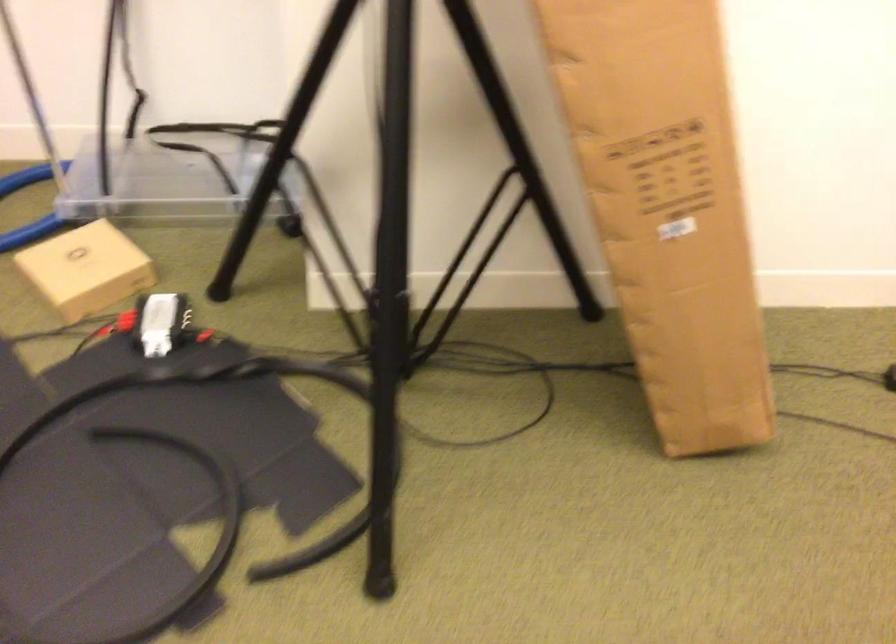
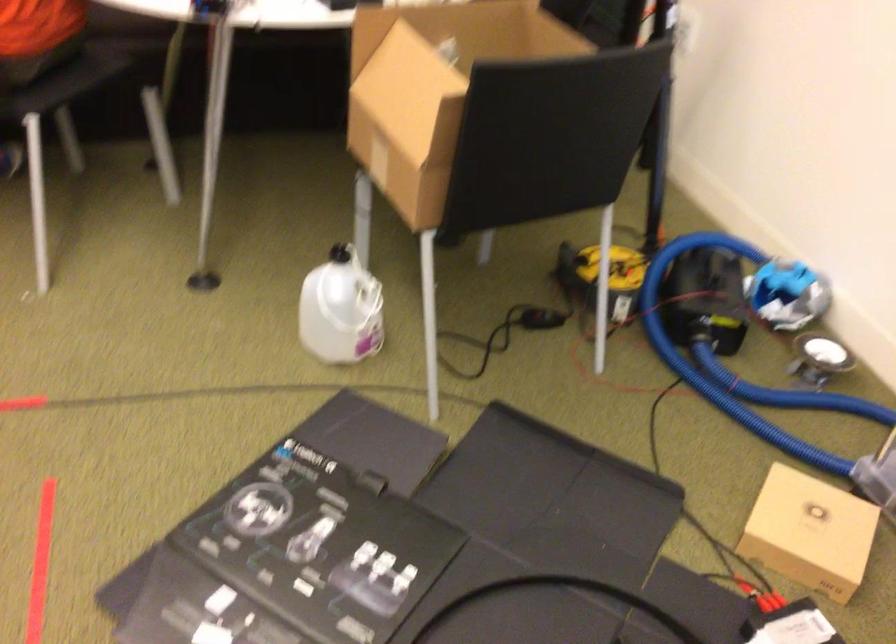
Locate, in the second image, the point that corresponds to point 90,266 in the first image.

(810, 532)